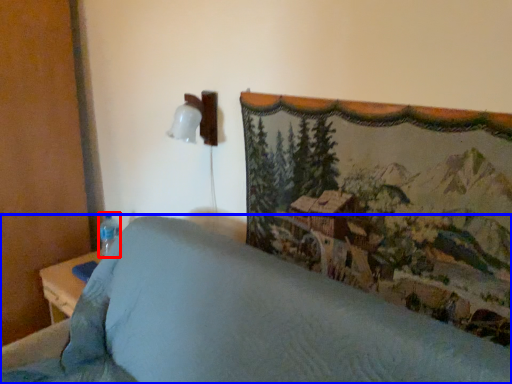
Question: Among these objects, which one is farthest to the camera, bottle (highlighted by a red box) or furniture (highlighted by a blue box)?

Choices:
 (A) bottle
 (B) furniture

Answer: (A)